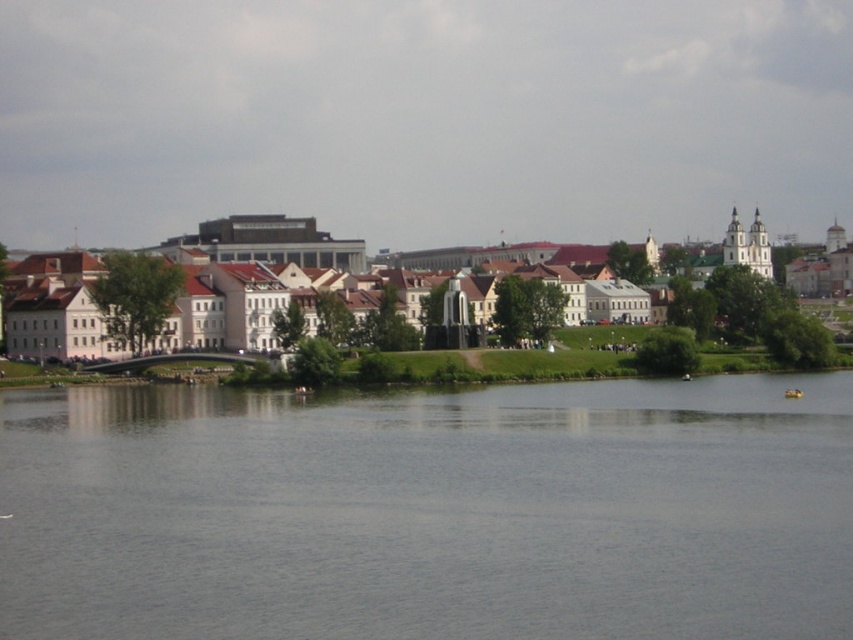
Does gray smooth water at center appear on the right side of white smooth buildings at center?

In fact, gray smooth water at center is to the left of white smooth buildings at center.

Who is more distant from viewer, (299, 614) or (799, 355)?

The point (799, 355) is behind.

This screenshot has width=853, height=640. Identify the location of gray smooth water at center. (430, 513).